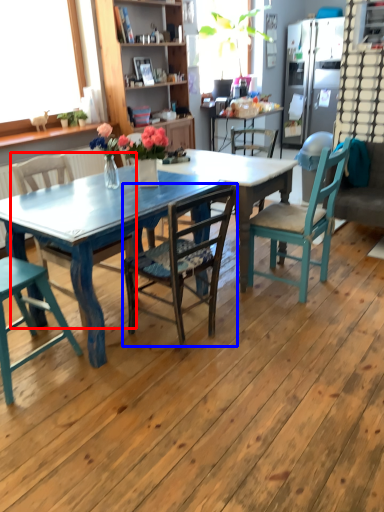
Question: Which object appears closest to the camera in this image, chair (highlighted by a red box) or chair (highlighted by a blue box)?

Choices:
 (A) chair
 (B) chair

Answer: (B)